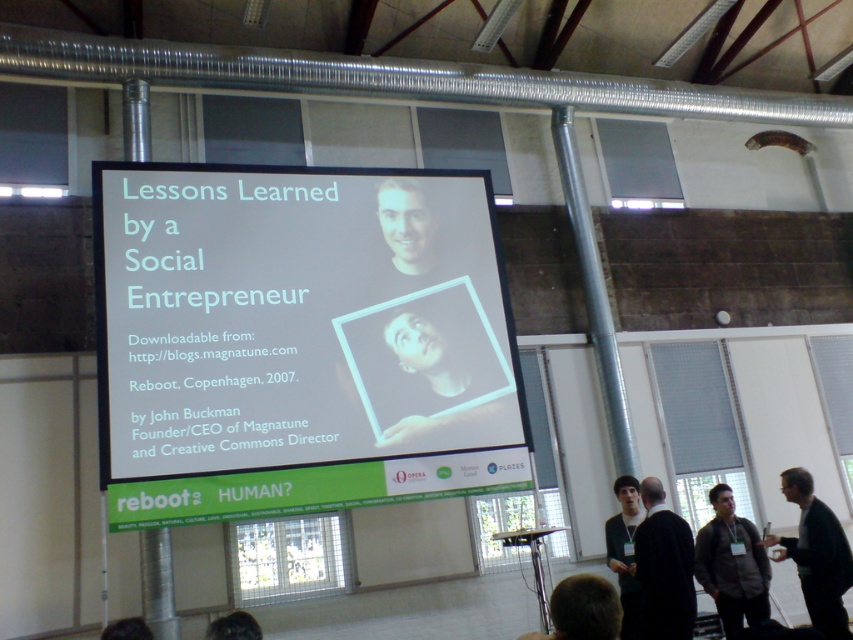
You are standing in the conference hall and want to move from the point at coordinates (289,419) to the point at (759,548). Can you walk directly between them without any obstacles?

Point (289,419) is in front of point (759,548), so there might be an obstacle between them. You cannot walk directly between them without any obstacles.

You are a photographer standing at the camera position. You want to take a closeup shot of the presentation screen showing John Buckman. However, there is a black matte jacket at lower right in the way. Can you move forward to take the photo without getting too close to the jacket?

The black matte jacket at lower right is 4.49 meters away from the camera. Since the photographer is at the camera position, moving forward by about 2 meters would allow them to get closer to the presentation screen while maintaining a safe distance of over 2 meters from the jacket, thus avoiding obstruction.

You are standing in the conference hall and want to locate the white glossy projector screen at center. What are the coordinates where you should look?

The white glossy projector screen at center is located at coordinates point (299, 340).